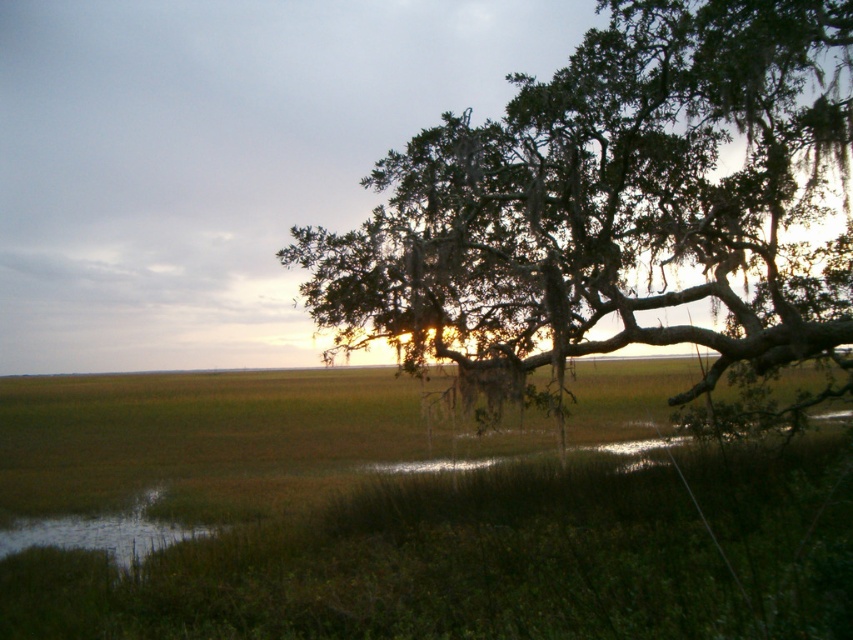
Question: Is green leafy tree at right above green grassy water at lower left?

Choices:
 (A) yes
 (B) no

Answer: (A)

Question: Can you confirm if green leafy tree at right is smaller than green grassy water at lower left?

Choices:
 (A) no
 (B) yes

Answer: (A)

Question: Which point is closer to the camera taking this photo?

Choices:
 (A) (628, 28)
 (B) (33, 525)

Answer: (A)

Question: Which point is closer to the camera taking this photo?

Choices:
 (A) (53, 524)
 (B) (757, 204)

Answer: (B)

Question: Which point appears closest to the camera in this image?

Choices:
 (A) (804, 344)
 (B) (24, 548)

Answer: (A)

Question: Can you confirm if green leafy tree at right is smaller than green grassy water at lower left?

Choices:
 (A) yes
 (B) no

Answer: (B)